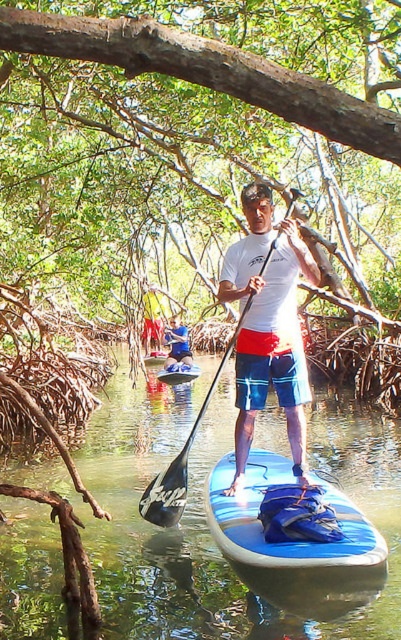
You are navigating a narrow path between two points in the mangrove forest. The first point is labeled as point (188, 353) and the second is point (164, 380). Which point should you approach first to stay on the correct path?

You should approach point (188, 353) first because it is closer to you than point (164, 380), which is further away.

You are a photographer trying to capture the blue rubber paddleboard at center and the white matte shirt at center in the same frame. Which object should you focus on first if you want to ensure both are in focus without adjusting the camera settings?

The blue rubber paddleboard at center has a lesser height compared to the white matte shirt at center, so you should focus on the taller object first, which is the white matte shirt at center, to ensure both are in focus.